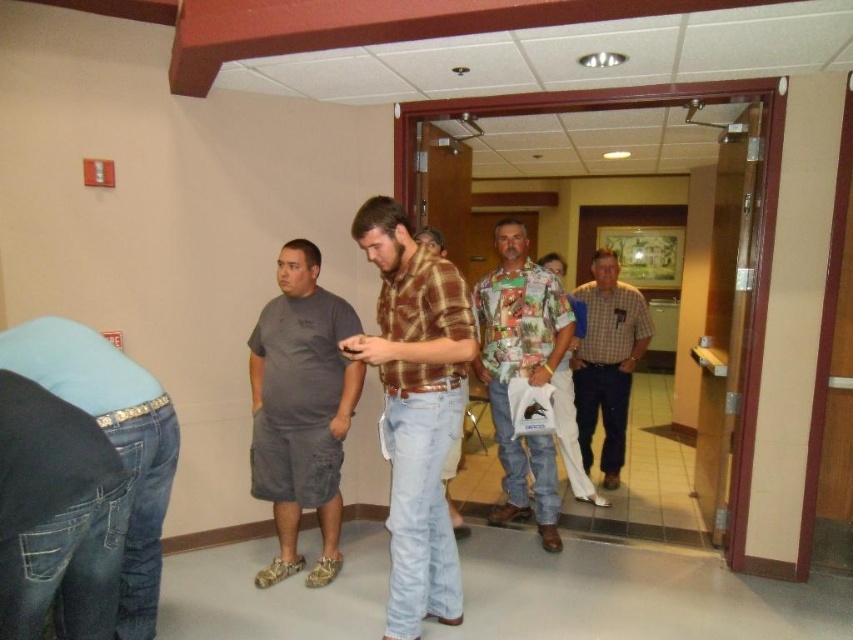
Question: Which point is closer to the camera taking this photo?

Choices:
 (A) (614, 348)
 (B) (520, 288)
 (C) (555, 387)
 (D) (361, 225)

Answer: (D)

Question: Which object is closer to the camera taking this photo?

Choices:
 (A) plaid shirt at center
 (B) gray cotton shorts at center
 (C) printed fabric shirt at center
 (D) checkered fabric shirt at center

Answer: (A)

Question: Which point is closer to the camera?

Choices:
 (A) printed fabric shirt at center
 (B) floral shirt at center
 (C) checkered fabric shirt at center
 (D) gray cotton shorts at center

Answer: (D)

Question: Does gray cotton shorts at center have a larger size compared to printed fabric shirt at center?

Choices:
 (A) no
 (B) yes

Answer: (A)

Question: Is gray cotton shorts at center to the right of floral shirt at center from the viewer's perspective?

Choices:
 (A) yes
 (B) no

Answer: (B)

Question: Does brown plaid shirt at center appear over floral shirt at center?

Choices:
 (A) yes
 (B) no

Answer: (B)